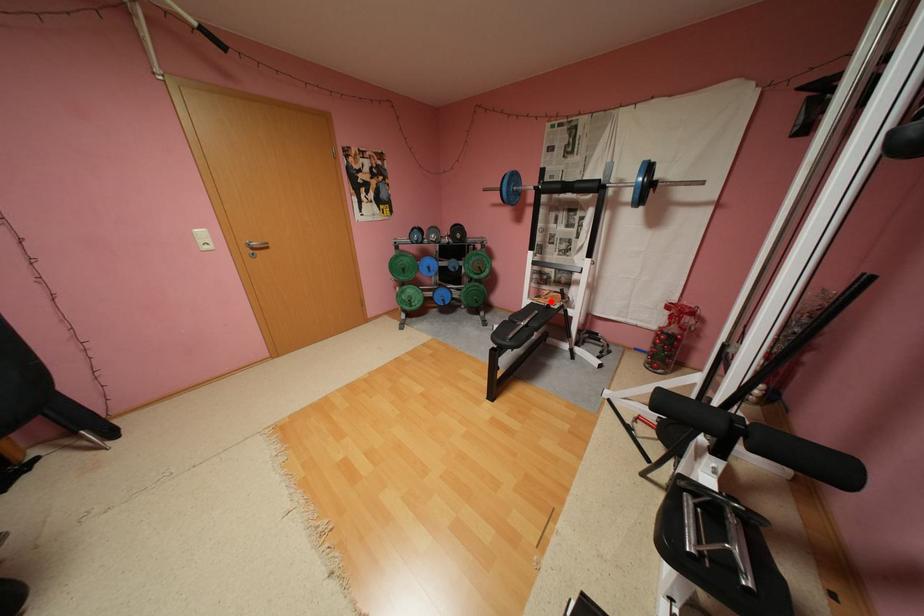
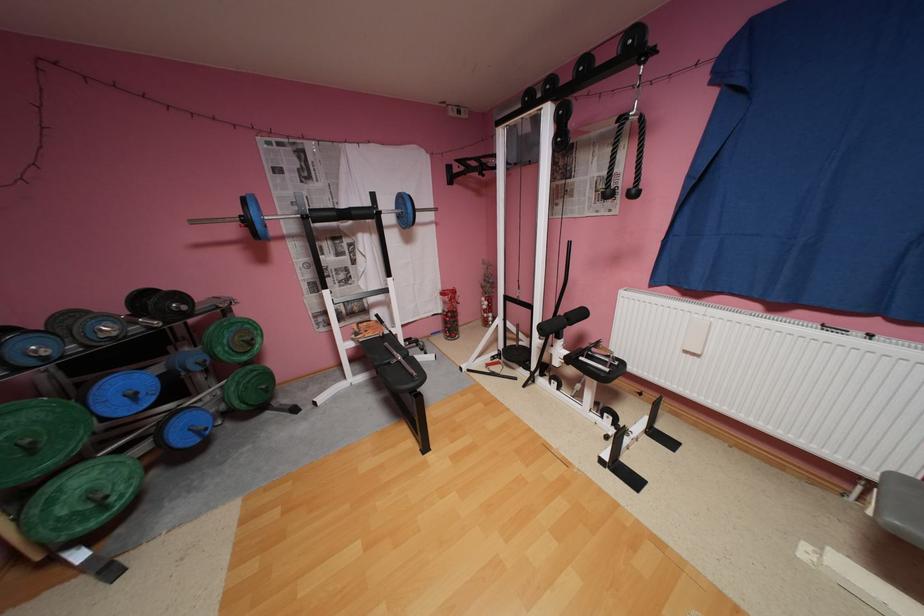
In the second image, find the point that corresponds to the highlighted location in the first image.

(380, 334)